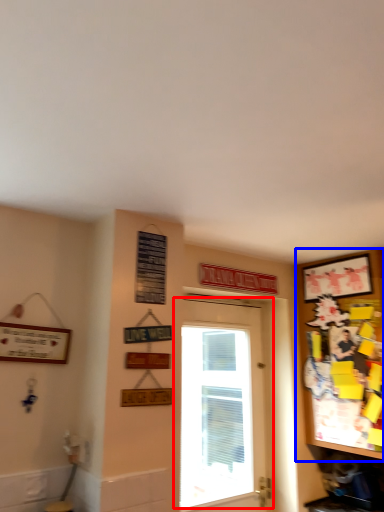
Question: Which point is further to the camera, door (highlighted by a red box) or cabinetry (highlighted by a blue box)?

Choices:
 (A) door
 (B) cabinetry

Answer: (A)